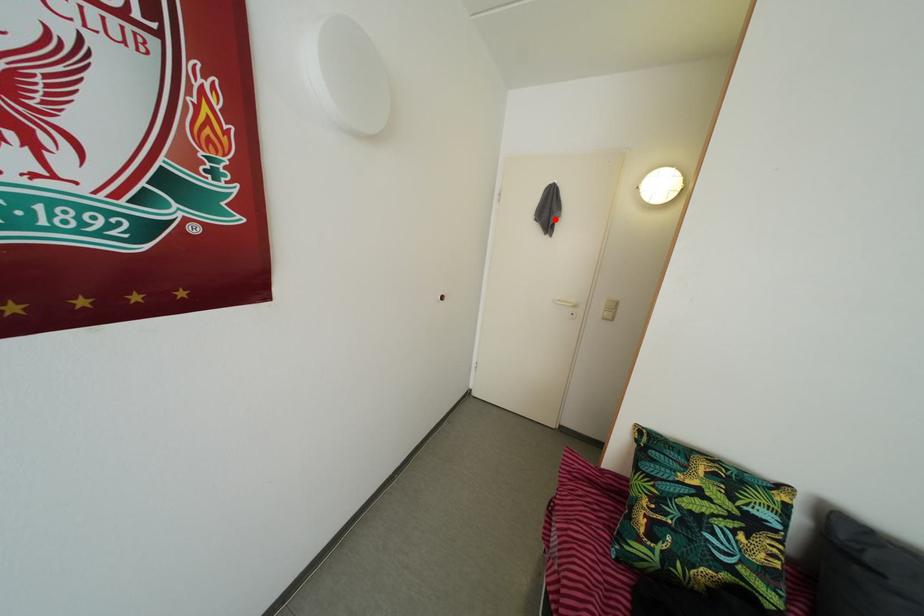
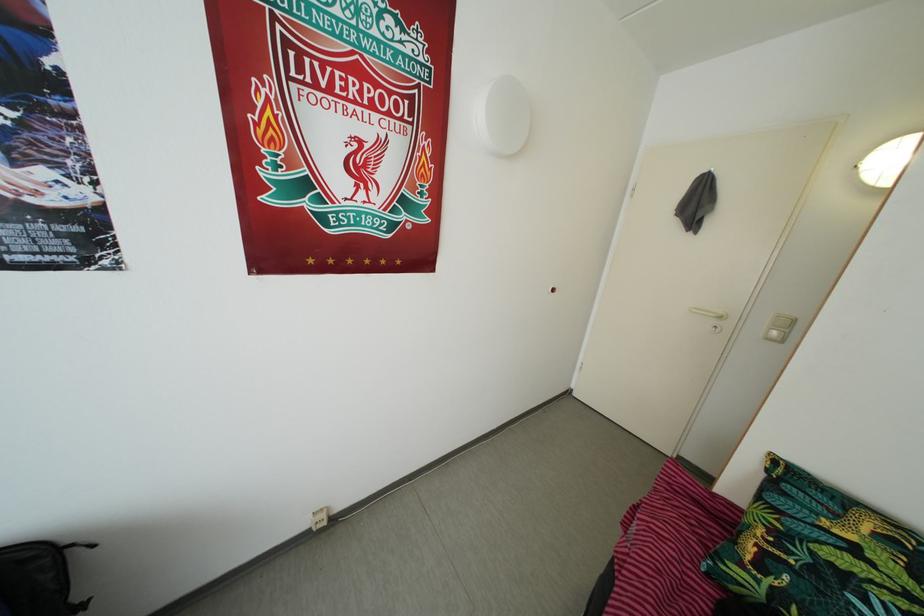
Where in the second image is the point corresponding to the highlighted location from the first image?

(703, 213)